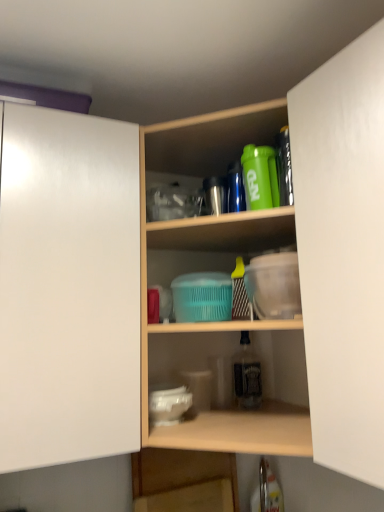
Question: Does clear glass bottle at center, which is the 2th bottle from front to back, appear on the right side of green matte shaker at upper center, which is the first bottle from top to bottom?

Choices:
 (A) yes
 (B) no

Answer: (A)

Question: Is clear glass bottle at center, marked as the 1th bottle in a bottom-to-top arrangement, looking in the opposite direction of green matte shaker at upper center, placed as the 2th bottle when sorted from back to front?

Choices:
 (A) no
 (B) yes

Answer: (A)

Question: Is clear glass bottle at center, which is counted as the first bottle, starting from the back, positioned behind green matte shaker at upper center, which is the first bottle from top to bottom?

Choices:
 (A) no
 (B) yes

Answer: (B)

Question: Is clear glass bottle at center, which is the 2th bottle from front to back, not near green matte shaker at upper center, placed as the 2th bottle when sorted from back to front?

Choices:
 (A) no
 (B) yes

Answer: (A)

Question: Considering the relative sizes of clear glass bottle at center, the 2th bottle viewed from the top, and green matte shaker at upper center, which is counted as the 1th bottle, starting from the front, in the image provided, is clear glass bottle at center, the 2th bottle viewed from the top, taller than green matte shaker at upper center, which is counted as the 1th bottle, starting from the front,?

Choices:
 (A) no
 (B) yes

Answer: (B)

Question: Does clear glass bottle at center, which is counted as the first bottle, starting from the back, appear on the left side of green matte shaker at upper center, which is the first bottle from top to bottom?

Choices:
 (A) no
 (B) yes

Answer: (A)

Question: From a real-world perspective, is white matte cabinet door at right, acting as the second cabinetry starting from the left, over wooden shelves at center, the first shelf viewed from the top?

Choices:
 (A) yes
 (B) no

Answer: (B)

Question: Is white matte cabinet door at right, acting as the second cabinetry starting from the left, further to the viewer compared to wooden shelves at center, marked as the second shelf in a bottom-to-top arrangement?

Choices:
 (A) yes
 (B) no

Answer: (B)

Question: Could you tell me if white matte cabinet door at right, the first cabinetry viewed from the right, is turned towards wooden shelves at center, marked as the second shelf in a bottom-to-top arrangement?

Choices:
 (A) yes
 (B) no

Answer: (B)

Question: Does white matte cabinet door at right, the first cabinetry viewed from the right, have a greater height compared to wooden shelves at center, marked as the second shelf in a bottom-to-top arrangement?

Choices:
 (A) yes
 (B) no

Answer: (B)

Question: Is white matte cabinet door at right, the first cabinetry viewed from the right, to the left of wooden shelves at center, the first shelf viewed from the top, from the viewer's perspective?

Choices:
 (A) no
 (B) yes

Answer: (A)

Question: Considering the relative sizes of white matte cabinet door at right, the first cabinetry viewed from the right, and wooden shelves at center, marked as the second shelf in a bottom-to-top arrangement, in the image provided, is white matte cabinet door at right, the first cabinetry viewed from the right, shorter than wooden shelves at center, marked as the second shelf in a bottom-to-top arrangement,?

Choices:
 (A) yes
 (B) no

Answer: (A)

Question: Does white matte cabinet door at left, marked as the 2th cabinetry in a right-to-left arrangement, appear on the left side of green matte shaker at upper center, placed as the 2th bottle when sorted from back to front?

Choices:
 (A) yes
 (B) no

Answer: (A)